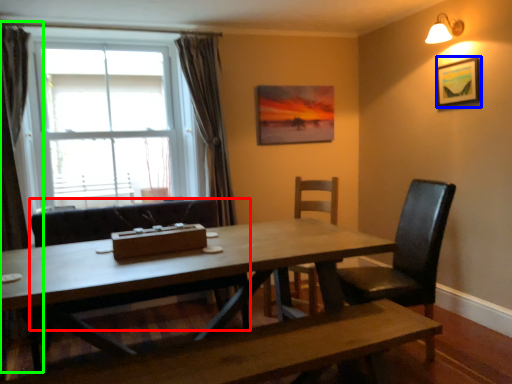
Question: Which is nearer to the chair (highlighted by a red box)? picture frame (highlighted by a blue box) or curtain (highlighted by a green box).

Choices:
 (A) picture frame
 (B) curtain

Answer: (B)